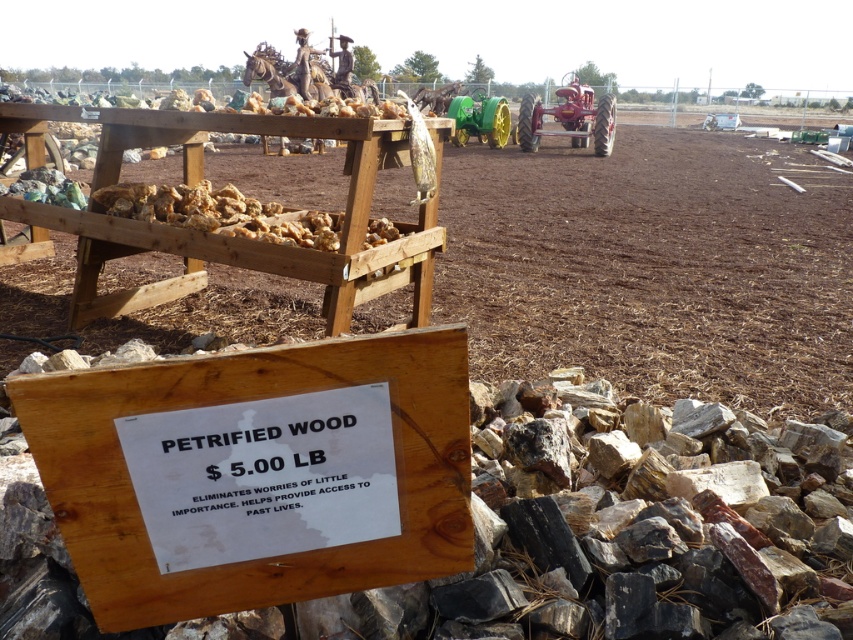
You are a customer at the petrified wood market. You see the brown mulch at center and the wooden sign at lower center. Which object is wider?

The brown mulch at center is wider than the wooden sign at lower center.

You are standing in the market area and see both the red metal tractor at center and the green rubber tractor at center. Which tractor is positioned to the right when facing the scene?

The red metal tractor at center is positioned to the right of the green rubber tractor at center when facing the scene.